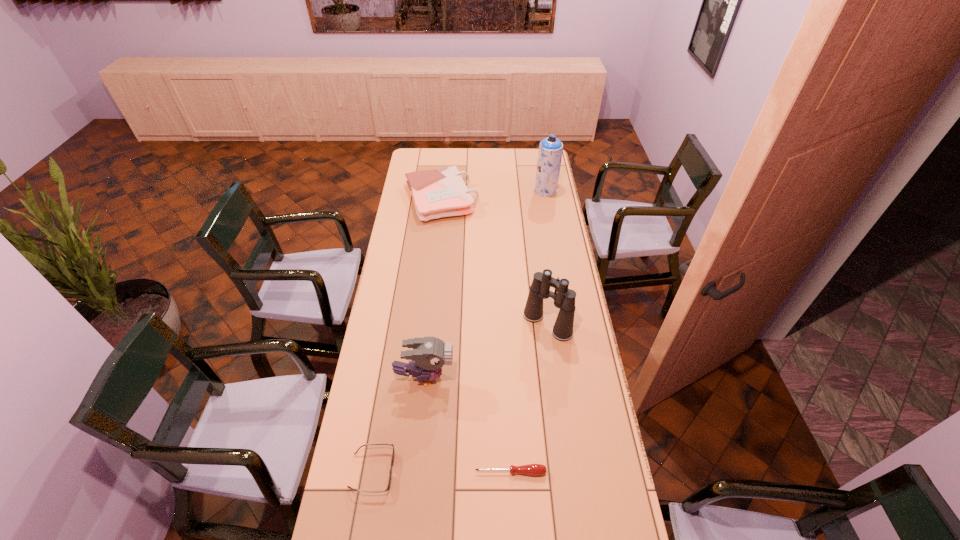
In the image, there is a desktop. Identify the location of blank space at the left edge. This screenshot has width=960, height=540. (368, 446).

Where is `free space at the right edge of the desktop`? Image resolution: width=960 pixels, height=540 pixels. free space at the right edge of the desktop is located at coordinates (573, 430).

This screenshot has height=540, width=960. In order to click on vacant region at the far right corner in this screenshot , I will do `click(533, 157)`.

Locate an element on the screen. The width and height of the screenshot is (960, 540). free space between the second tallest object and the sunglasses is located at coordinates (460, 397).

The height and width of the screenshot is (540, 960). Identify the location of free space between the sunglasses and the binoculars. (460, 397).

Where is `vacant area that lies between the second tallest object and the tallest object`? This screenshot has width=960, height=540. vacant area that lies between the second tallest object and the tallest object is located at coordinates (546, 257).

In order to click on blank region between the sunglasses and the fourth tallest object in this screenshot , I will do `click(407, 335)`.

You are a GUI agent. You are given a task and a screenshot of the screen. Output one action in this format:
    pyautogui.click(x=<x>, y=<y>)
    Task: Click on the empty space that is in between the second tallest object and the aerosol can
    The height and width of the screenshot is (540, 960).
    Given the screenshot: What is the action you would take?
    pyautogui.click(x=546, y=257)

Find the location of `empty location between the screwdriver and the third shortest object`. empty location between the screwdriver and the third shortest object is located at coordinates (476, 335).

Locate an element on the screen. Image resolution: width=960 pixels, height=540 pixels. vacant point located between the second tallest object and the sunglasses is located at coordinates (460, 397).